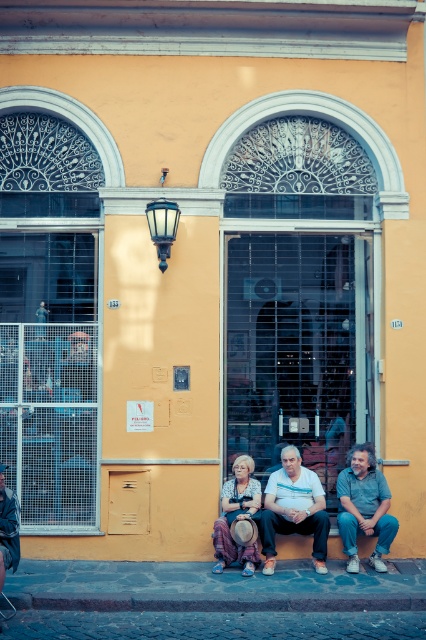
Who is positioned more to the left, gray concrete curb at lower center or white cotton shirt at center?

From the viewer's perspective, gray concrete curb at lower center appears more on the left side.

Can you confirm if gray concrete curb at lower center is positioned above white cotton shirt at center?

No.

Identify the location of gray concrete curb at lower center. (227, 602).

Image resolution: width=426 pixels, height=640 pixels. Find the location of `gray concrete curb at lower center`. gray concrete curb at lower center is located at coordinates (227, 602).

Is denim jeans at lower right closer to camera compared to denim jacket at lower left?

That is False.

Does denim jeans at lower right have a lesser width compared to denim jacket at lower left?

Incorrect, denim jeans at lower right's width is not less than denim jacket at lower left's.

Is point (359, 506) farther from camera compared to point (6, 516)?

Yes, point (359, 506) is farther from viewer.

At what (x,y) coordinates should I click in order to perform the action: click on denim jeans at lower right. Please return your answer as a coordinate pair (x, y). This screenshot has height=640, width=426. Looking at the image, I should click on (363, 506).

Can you confirm if white cotton shirt at center is taller than striped fabric dress at center?

Indeed, white cotton shirt at center has a greater height compared to striped fabric dress at center.

Based on the photo, is white cotton shirt at center in front of striped fabric dress at center?

No, it is behind striped fabric dress at center.

Which is in front, point (276, 525) or point (236, 560)?

Positioned in front is point (236, 560).

The height and width of the screenshot is (640, 426). In order to click on white cotton shirt at center in this screenshot , I will do `click(293, 508)`.